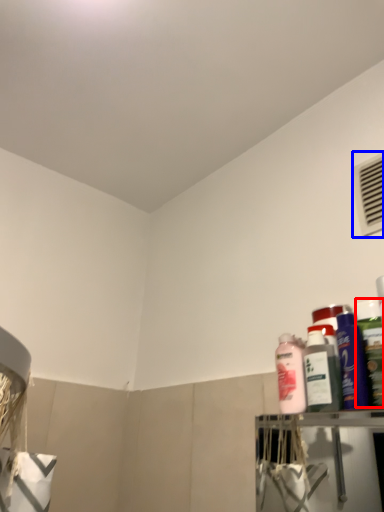
Question: Which object appears closest to the camera in this image, cleaning product (highlighted by a red box) or air conditioning (highlighted by a blue box)?

Choices:
 (A) cleaning product
 (B) air conditioning

Answer: (A)